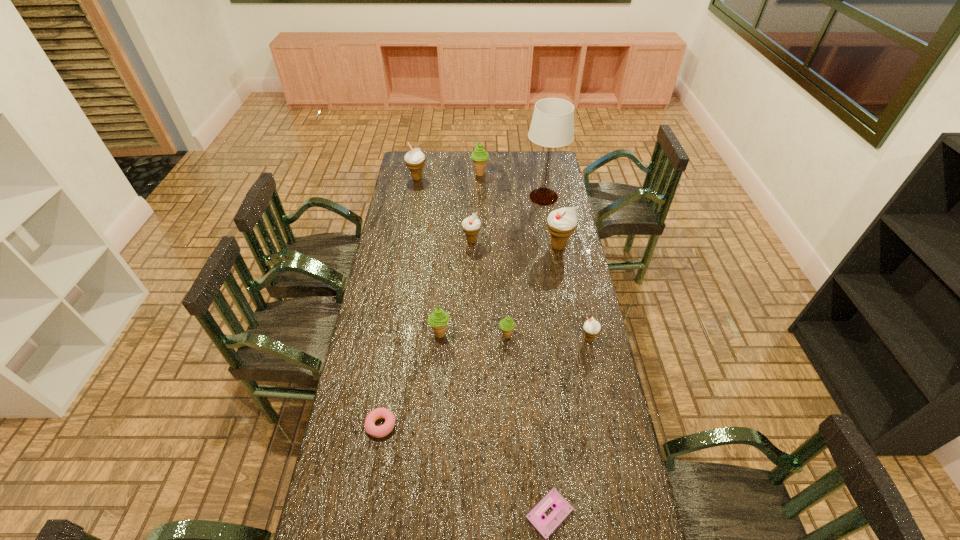
Where is `free location located 0.200m on the right of the farthest green icecream`? The width and height of the screenshot is (960, 540). free location located 0.200m on the right of the farthest green icecream is located at coordinates (524, 174).

This screenshot has width=960, height=540. What are the coordinates of `free space located 0.150m on the front of the farthest white icecream` in the screenshot? It's located at (414, 201).

I want to click on free space located on the right of the second icecream from left to right, so click(494, 334).

Image resolution: width=960 pixels, height=540 pixels. I want to click on free space located on the back of the second smallest white icecream, so click(472, 187).

The height and width of the screenshot is (540, 960). What are the coordinates of `vacant space located 0.290m on the left of the nearest white icecream` in the screenshot? It's located at (504, 339).

The image size is (960, 540). In order to click on free space located on the left of the third icecream from right to left in this screenshot , I will do `click(455, 335)`.

Locate an element on the screen. Image resolution: width=960 pixels, height=540 pixels. vacant space located on the back of the doughnut is located at coordinates (393, 356).

Identify the location of icecream that is at the left edge. The height and width of the screenshot is (540, 960). (415, 160).

Where is `doughnut that is positioned at the left edge`? This screenshot has width=960, height=540. doughnut that is positioned at the left edge is located at coordinates (375, 431).

At what (x,y) coordinates should I click in order to perform the action: click on table lamp that is at the right edge. Please return your answer as a coordinate pair (x, y). This screenshot has width=960, height=540. Looking at the image, I should click on (552, 125).